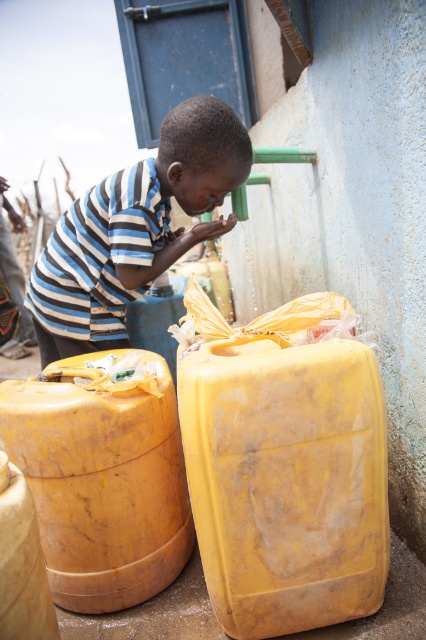
Looking at this image, does matte yellow barrel at lower left have a greater width compared to striped fabric boy at center?

In fact, matte yellow barrel at lower left might be narrower than striped fabric boy at center.

Where is `matte yellow barrel at lower left`? The height and width of the screenshot is (640, 426). matte yellow barrel at lower left is located at coordinates (101, 481).

Measure the distance from yellow matte barrel at right to matte yellow barrel at lower left.

yellow matte barrel at right and matte yellow barrel at lower left are 13.99 inches apart.

Who is taller, yellow matte barrel at right or matte yellow barrel at lower left?

yellow matte barrel at right

The height and width of the screenshot is (640, 426). What do you see at coordinates (287, 481) in the screenshot? I see `yellow matte barrel at right` at bounding box center [287, 481].

Where is `yellow matte barrel at right`? yellow matte barrel at right is located at coordinates (287, 481).

Which is more to the right, yellow matte barrel at right or striped fabric boy at center?

Positioned to the right is yellow matte barrel at right.

Between yellow matte barrel at right and striped fabric boy at center, which one appears on the left side from the viewer's perspective?

striped fabric boy at center

Describe the element at coordinates (287, 481) in the screenshot. I see `yellow matte barrel at right` at that location.

In order to click on yellow matte barrel at right in this screenshot , I will do `click(287, 481)`.